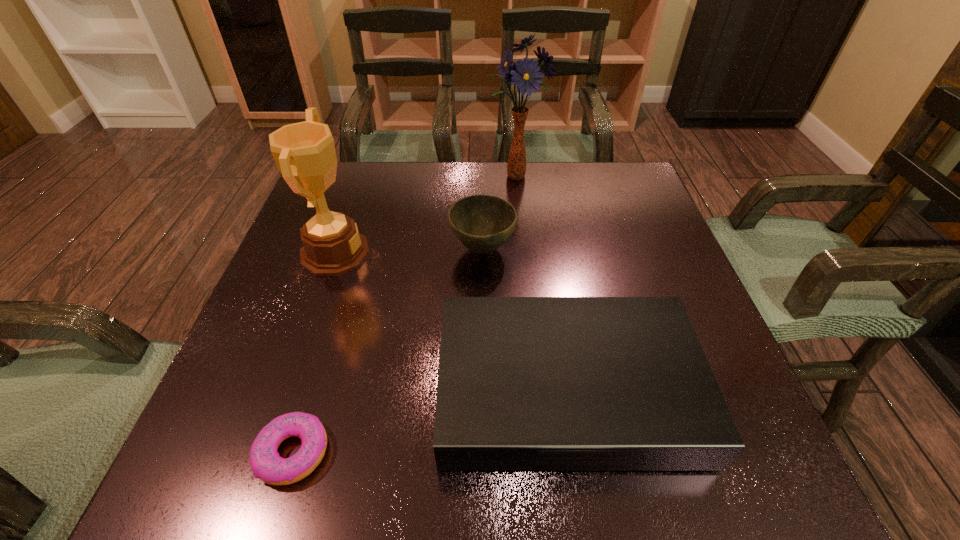
Find the location of a particular element. The image size is (960, 540). vacant area between the bowl and the fourth shortest object is located at coordinates (409, 251).

Locate an element on the screen. This screenshot has width=960, height=540. empty space that is in between the second tallest object and the doughnut is located at coordinates (314, 352).

You are a GUI agent. You are given a task and a screenshot of the screen. Output one action in this format:
    pyautogui.click(x=<x>, y=<y>)
    Task: Click on the vacant area between the award and the bowl
    This screenshot has height=540, width=960.
    Given the screenshot: What is the action you would take?
    pyautogui.click(x=409, y=251)

Where is `free space between the shortest object and the bowl`? The width and height of the screenshot is (960, 540). free space between the shortest object and the bowl is located at coordinates (388, 350).

The height and width of the screenshot is (540, 960). Identify the location of object that ranks as the closest to the third tallest object. (525, 383).

Where is `object that is the second closest to the shortest object`? This screenshot has height=540, width=960. object that is the second closest to the shortest object is located at coordinates (304, 152).

The image size is (960, 540). What are the coordinates of `vacant space that satisfies the following two spatial constraints: 1. on the back side of the flower arrangement; 2. on the right side of the shortest object` in the screenshot? It's located at (376, 177).

What are the coordinates of `free location that satisfies the following two spatial constraints: 1. on the back side of the shortest object; 2. on the left side of the flower arrangement` in the screenshot? It's located at (376, 177).

Where is `free space that satisfies the following two spatial constraints: 1. on the front-facing side of the award; 2. on the right side of the doughnut`? free space that satisfies the following two spatial constraints: 1. on the front-facing side of the award; 2. on the right side of the doughnut is located at coordinates (266, 452).

Locate an element on the screen. free space that satisfies the following two spatial constraints: 1. on the back side of the tallest object; 2. on the right side of the bowl is located at coordinates (482, 177).